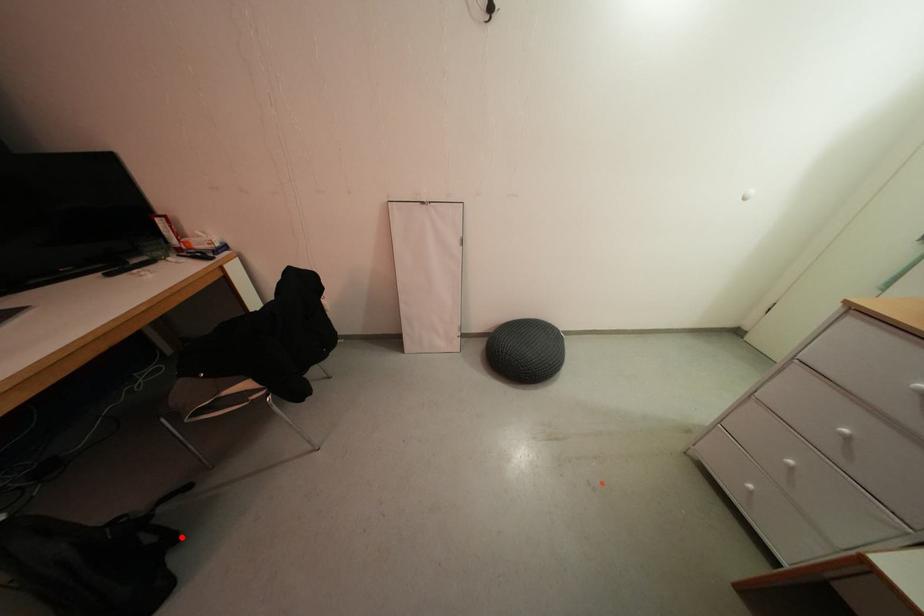
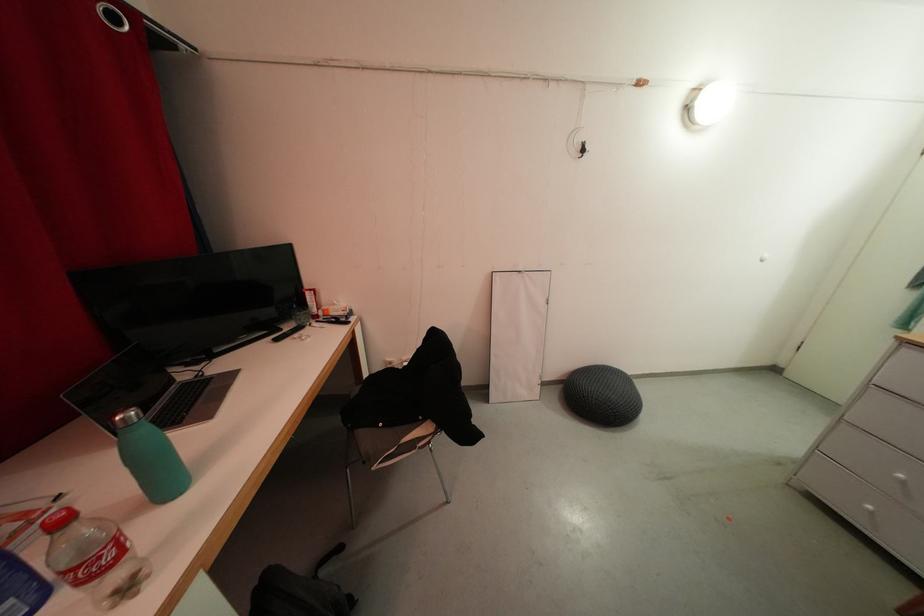
Question: I am providing you with two images of the same scene from different viewpoints. Image1 has a red point marked. In image2, the corresponding 3D location appears at what relative position? Reply with the corresponding letter.

Choices:
 (A) Closer
 (B) Farther

Answer: (A)